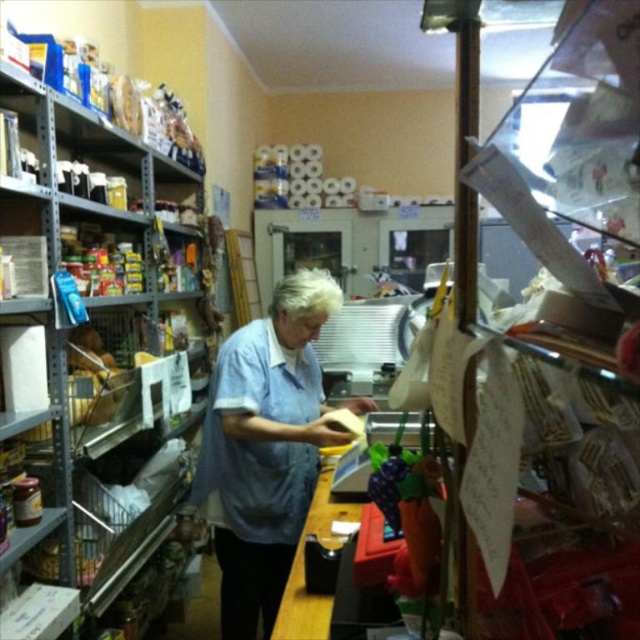
You are a customer trying to place an order at the counter. The metallic silver shelves at left and the blue cotton shirt at center are both in your line of sight. Which object is narrower?

The metallic silver shelves at left has a lesser width compared to the blue cotton shirt at center, so the metallic silver shelves at left is narrower.

Based on the photo, you are a customer in the store and need to reach an item on the highest shelf of the metallic silver shelves at left. Considering the height of the blue cotton shirt at center, do you think the shelves are too tall for you to reach without a ladder?

The metallic silver shelves at left are taller than the blue cotton shirt at center. Since the blue cotton shirt at center is worn by a person, the shelves are likely taller than the average person, making it difficult to reach the top without a ladder.